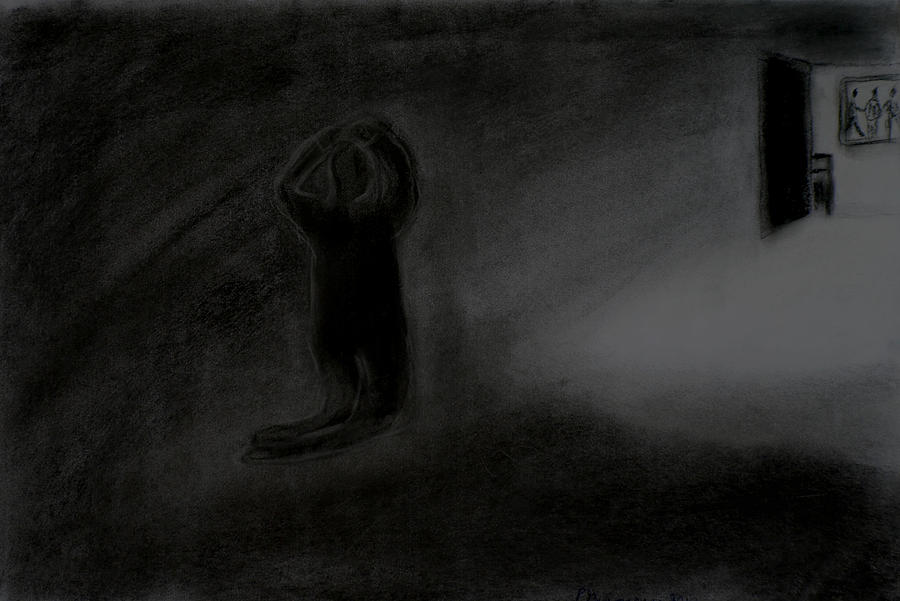
At what (x,y) coordinates should I click in order to perform the action: click on picture frame. Please return your answer as a coordinate pair (x, y). The image size is (900, 601). Looking at the image, I should click on (844, 85).